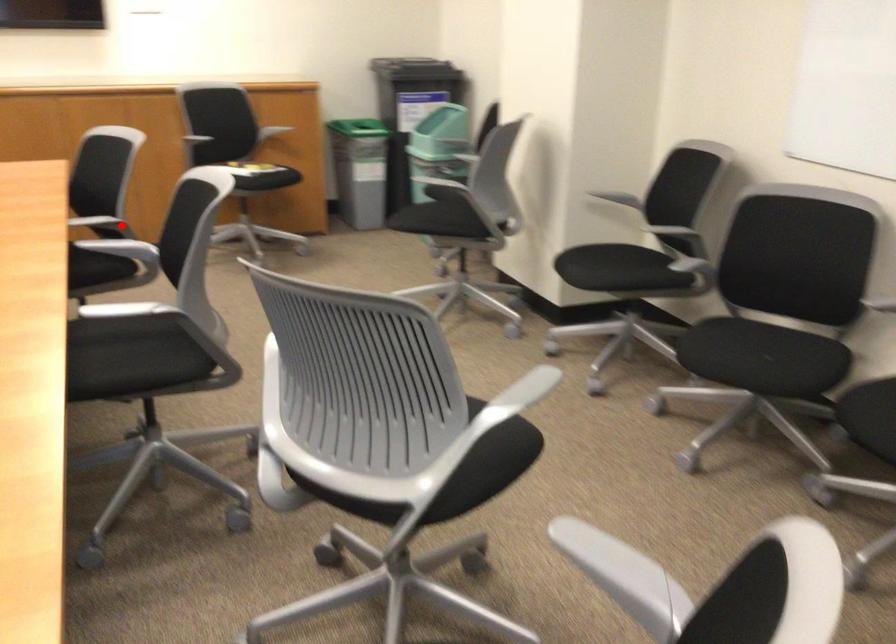
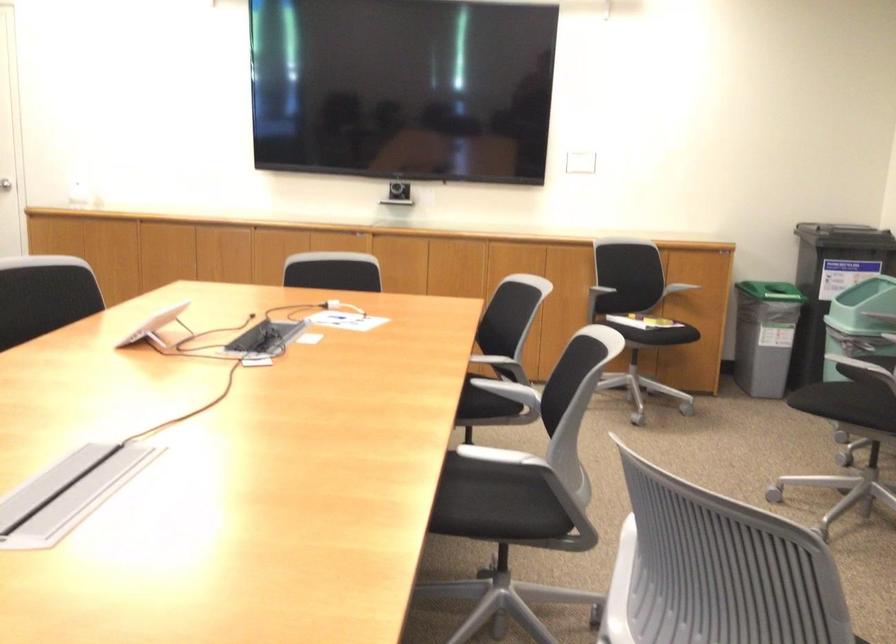
The point at the highlighted location is marked in the first image. Where is the corresponding point in the second image?

(505, 366)